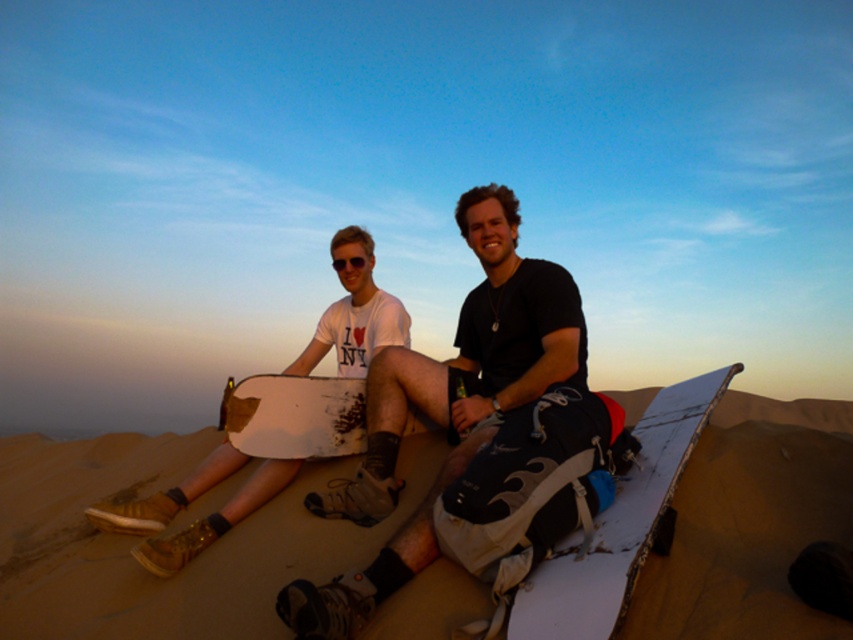
Is point (741, 426) positioned after point (637, 513)?

That is True.

Where is `brown sandy at center`? The width and height of the screenshot is (853, 640). brown sandy at center is located at coordinates (135, 538).

Between white cotton t-shirt at center and white matte snowboard at center, which one is positioned lower?

white matte snowboard at center is below.

Identify the location of white cotton t-shirt at center. This screenshot has width=853, height=640. (447, 406).

Between point (531, 358) and point (637, 464), which one is positioned behind?

The point (531, 358) is behind.

Where is `white cotton t-shirt at center`? Image resolution: width=853 pixels, height=640 pixels. white cotton t-shirt at center is located at coordinates (447, 406).

Is point (210, 496) positioned before point (550, 268)?

No, it is behind (550, 268).

Can you confirm if brown sandy at center is thinner than white cotton t-shirt at center?

Correct, brown sandy at center's width is less than white cotton t-shirt at center's.

The image size is (853, 640). I want to click on brown sandy at center, so click(x=135, y=538).